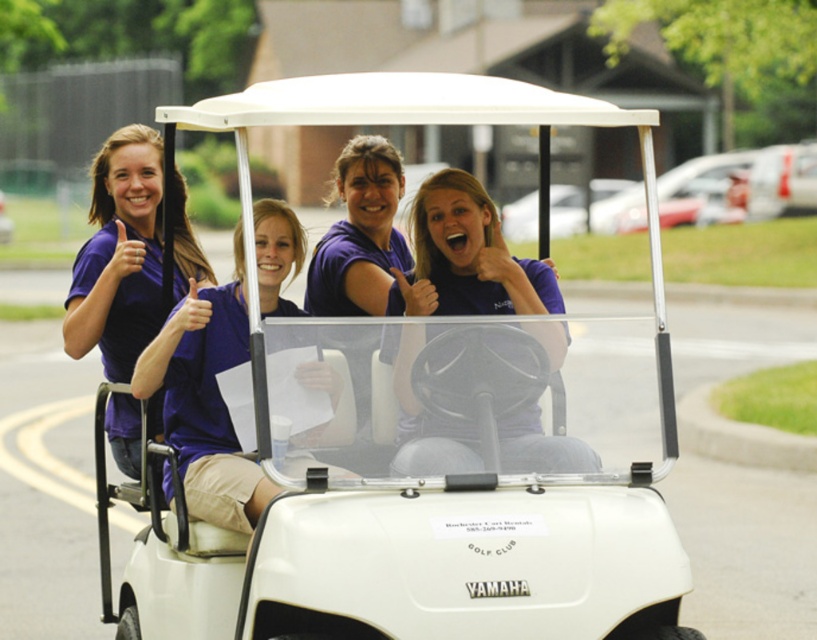
Is purple matte shirt at center above matte purple shirt at left?

No, purple matte shirt at center is not above matte purple shirt at left.

Which is above, purple matte shirt at center or matte purple shirt at left?

matte purple shirt at left is higher up.

Identify the location of purple matte shirt at center. (469, 257).

Can you confirm if white matte golf cart at center is bigger than purple matte shirt at center?

Correct, white matte golf cart at center is larger in size than purple matte shirt at center.

Consider the image. Is white matte golf cart at center taller than purple matte shirt at center?

Correct, white matte golf cart at center is much taller as purple matte shirt at center.

Between point (476, 266) and point (454, 284), which one is positioned in front?

Point (476, 266) is in front.

Locate an element on the screen. The height and width of the screenshot is (640, 817). white matte golf cart at center is located at coordinates (409, 426).

Does white matte golf cart at center appear over matte purple shirt at left?

Actually, white matte golf cart at center is below matte purple shirt at left.

Locate an element on the screen. white matte golf cart at center is located at coordinates (409, 426).

Locate an element on the screen. Image resolution: width=817 pixels, height=640 pixels. white matte golf cart at center is located at coordinates (409, 426).

Identify the location of white matte golf cart at center. The height and width of the screenshot is (640, 817). (409, 426).